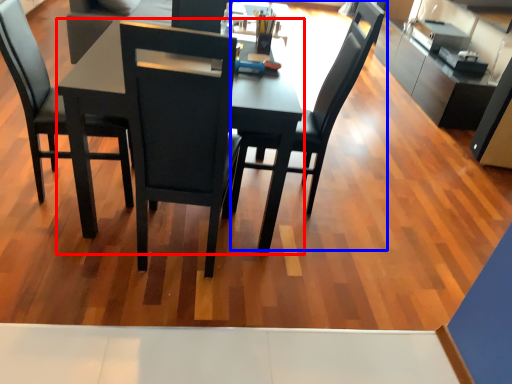
Question: Which object appears closest to the camera in this image, round table (highlighted by a red box) or chair (highlighted by a blue box)?

Choices:
 (A) round table
 (B) chair

Answer: (A)